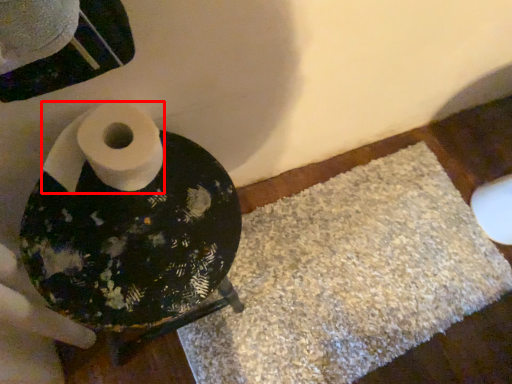
Question: From the image's perspective, what is the correct spatial relationship of toilet paper (annotated by the red box) in relation to bath mat?

Choices:
 (A) above
 (B) below

Answer: (A)